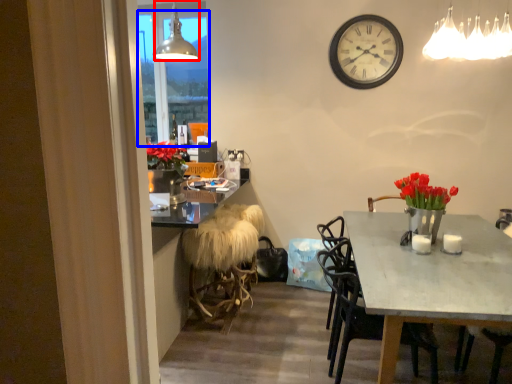
Question: Which point is further to the camera, lamp (highlighted by a red box) or window screen (highlighted by a blue box)?

Choices:
 (A) lamp
 (B) window screen

Answer: (B)